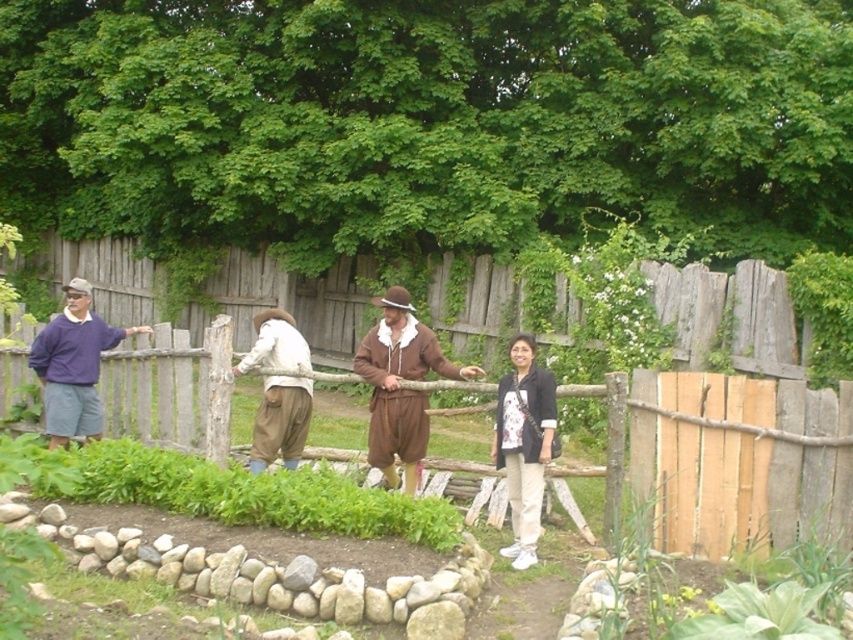
Question: Among these points, which one is farthest from the camera?

Choices:
 (A) (51, 337)
 (B) (270, 364)

Answer: (A)

Question: Which is nearer to the purple sweater at left?

Choices:
 (A) brown suede outfit at center
 (B) white cotton pants at center

Answer: (A)

Question: Is white cotton pants at center further to the viewer compared to white cotton shirt at center?

Choices:
 (A) yes
 (B) no

Answer: (B)

Question: Estimate the real-world distances between objects in this image. Which object is farther from the brown suede outfit at center?

Choices:
 (A) purple sweater at left
 (B) white cotton pants at center

Answer: (A)

Question: Is white cotton pants at center above purple sweater at left?

Choices:
 (A) no
 (B) yes

Answer: (A)

Question: Can you confirm if white cotton pants at center is positioned to the left of purple sweater at left?

Choices:
 (A) no
 (B) yes

Answer: (A)